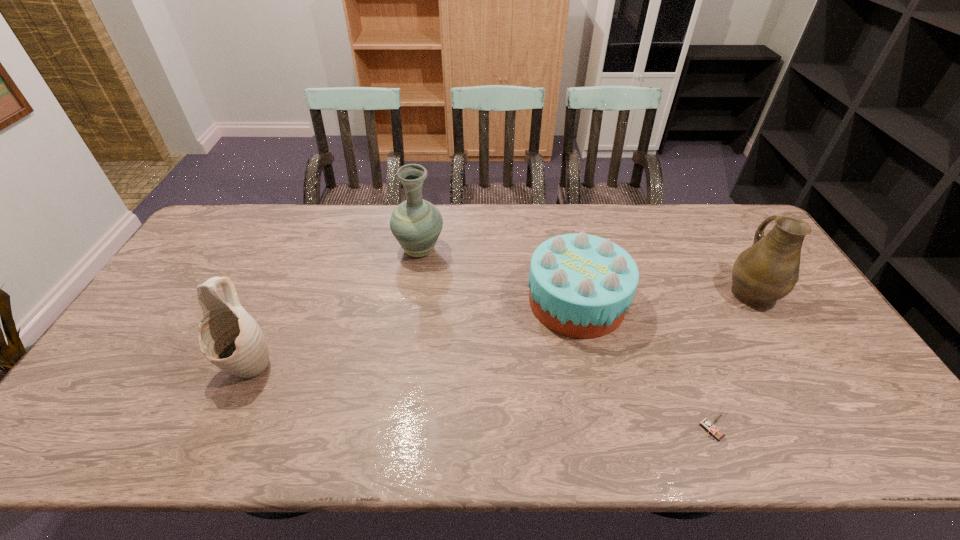
At what (x,y) coordinates should I click in order to perform the action: click on unoccupied position between the cake and the fourth object from left to right. Please return your answer as a coordinate pair (x, y). The width and height of the screenshot is (960, 540). Looking at the image, I should click on 644,366.

Where is `unoccupied position between the leftmost pitcher and the rightmost object`? This screenshot has width=960, height=540. unoccupied position between the leftmost pitcher and the rightmost object is located at coordinates (500, 328).

Locate an element on the screen. empty space between the leftmost pitcher and the farthest object is located at coordinates (335, 307).

Locate an element on the screen. Image resolution: width=960 pixels, height=540 pixels. free space between the second object from right to left and the leftmost object is located at coordinates 481,397.

The width and height of the screenshot is (960, 540). I want to click on free point between the nearest pitcher and the third object from right to left, so click(414, 333).

In order to click on vacant point located between the farthest pitcher and the nearest object in this screenshot , I will do `click(565, 340)`.

Find the location of `empty space between the second shortest object and the farthest pitcher`. empty space between the second shortest object and the farthest pitcher is located at coordinates (498, 276).

Image resolution: width=960 pixels, height=540 pixels. I want to click on object that ranks as the third closest to the second shortest object, so click(x=767, y=271).

Where is `object that is the nearest to the third object from right to left`? object that is the nearest to the third object from right to left is located at coordinates (711, 427).

This screenshot has width=960, height=540. I want to click on the closest pitcher to the nearest object, so click(767, 271).